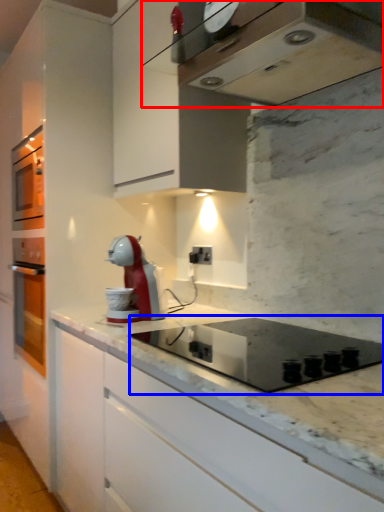
Question: Which of the following is the closest to the observer, home appliance (highlighted by a red box) or appliance (highlighted by a blue box)?

Choices:
 (A) home appliance
 (B) appliance

Answer: (A)